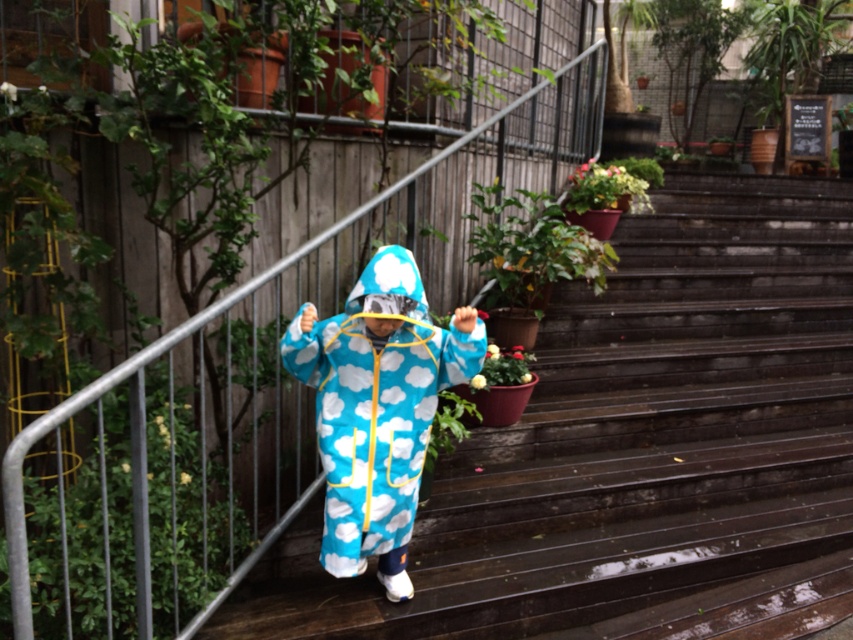
Does point (370, 292) lie behind point (573, 193)?

No, it is in front of (573, 193).

Which is more to the right, blue cloud-patterned jumpsuit at center or green matte flower pot at upper center?

green matte flower pot at upper center

Does point (415, 321) lie behind point (614, 168)?

That is False.

Where is `blue cloud-patterned jumpsuit at center`? The height and width of the screenshot is (640, 853). blue cloud-patterned jumpsuit at center is located at coordinates (376, 406).

Is green leafy plant at lower left smaller than green leafy plant at center?

No, green leafy plant at lower left is not smaller than green leafy plant at center.

Is point (76, 483) farther from viewer compared to point (457, 417)?

No, (76, 483) is closer to viewer.

Identify the location of green leafy plant at lower left. (86, 536).

Who is lower down, green leafy plant at lower left or green matte flower pot at upper center?

Positioned lower is green leafy plant at lower left.

Based on the photo, is green leafy plant at lower left positioned in front of green matte flower pot at upper center?

Yes.

What do you see at coordinates (86, 536) in the screenshot?
I see `green leafy plant at lower left` at bounding box center [86, 536].

Image resolution: width=853 pixels, height=640 pixels. Find the location of `green leafy plant at lower left`. green leafy plant at lower left is located at coordinates (86, 536).